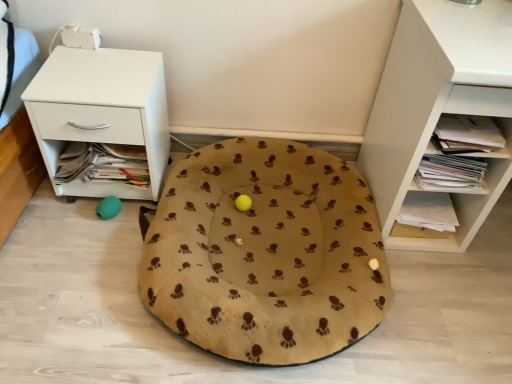
You are a GUI agent. You are given a task and a screenshot of the screen. Output one action in this format:
    pyautogui.click(x=<x>, y=<y>)
    Task: Click on the free spot in front of white glossy nightstand at left
    The height and width of the screenshot is (384, 512).
    Given the screenshot: What is the action you would take?
    pyautogui.click(x=76, y=249)